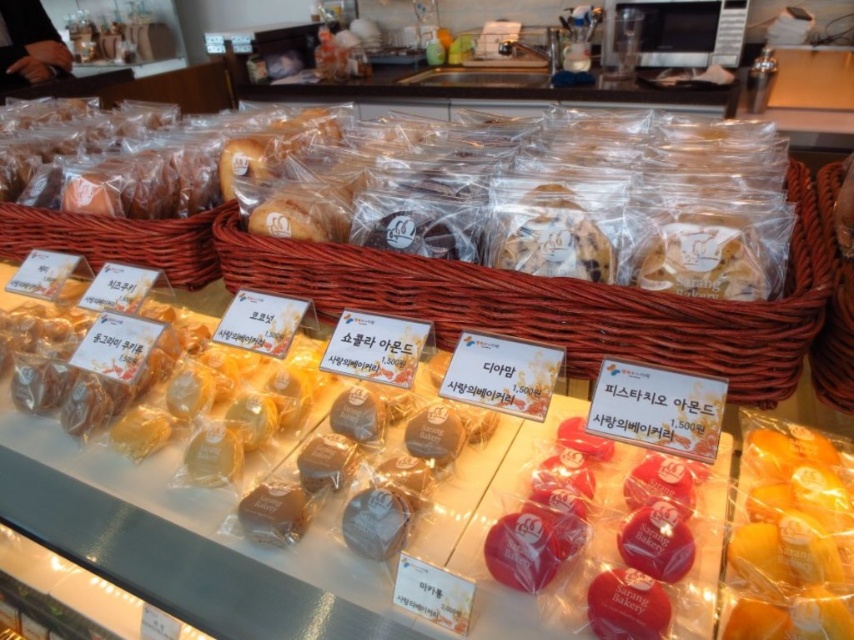
You are a customer at the bakery and want to choose a basket to carry your pastries. The brown woven basket at upper center and the brown woven basket at right are both available. Which basket has a larger width?

The brown woven basket at upper center has a larger width than the brown woven basket at right.

You are a customer looking at the bakery display. You want to buy a pastry from the brown woven basket at upper center and another from the brown woven basket at right. Which basket should you approach first if you want to pick items from both baskets in order from left to right?

The brown woven basket at upper center is to the left of the brown woven basket at right. Therefore, you should approach the brown woven basket at upper center first to pick items from left to right.